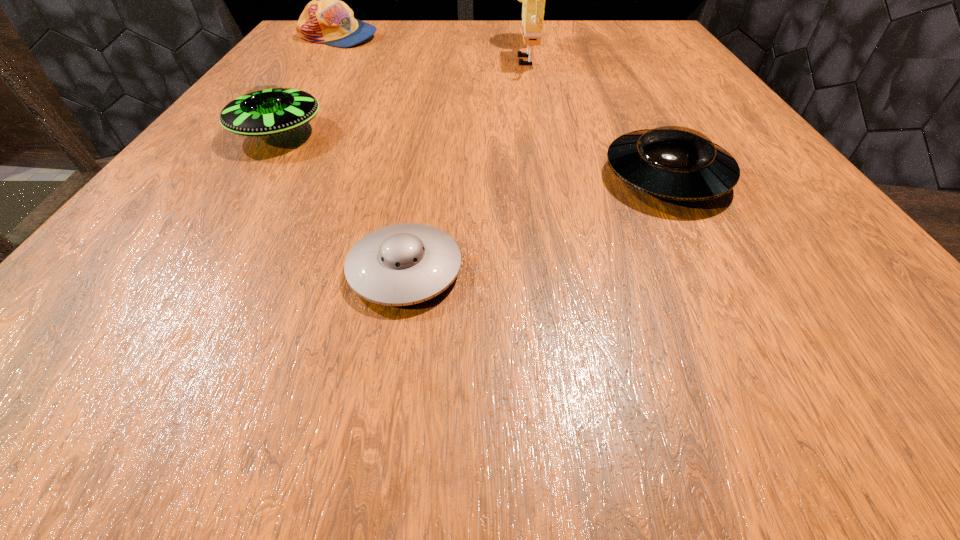
You are a GUI agent. You are given a task and a screenshot of the screen. Output one action in this format:
    pyautogui.click(x=<x>, y=<y>)
    Task: Click on the free space located on the front-facing side of the fourth object from left to right
    
    Given the screenshot: What is the action you would take?
    tap(332, 54)

The height and width of the screenshot is (540, 960). What are the coordinates of `free space located on the bill of the cap` in the screenshot? It's located at (440, 37).

You are a GUI agent. You are given a task and a screenshot of the screen. Output one action in this format:
    pyautogui.click(x=<x>, y=<y>)
    Task: Click on the vacant space situated on the front of the leftmost saucer
    Image resolution: width=960 pixels, height=540 pixels.
    Given the screenshot: What is the action you would take?
    pyautogui.click(x=185, y=276)

The image size is (960, 540). Find the location of `vacant space located 0.360m on the left of the rightmost object`. vacant space located 0.360m on the left of the rightmost object is located at coordinates (341, 177).

Find the location of `vacant area located 0.130m on the left of the nearest saucer`. vacant area located 0.130m on the left of the nearest saucer is located at coordinates (228, 270).

At what (x,y) coordinates should I click in order to perform the action: click on sponge that is at the far edge. Please return your answer as a coordinate pair (x, y). Looking at the image, I should click on (533, 0).

Locate an element on the screen. cap at the far edge is located at coordinates (326, 19).

Locate an element on the screen. Image resolution: width=960 pixels, height=540 pixels. cap at the left edge is located at coordinates (326, 19).

In order to click on saucer present at the left edge in this screenshot , I will do `click(265, 110)`.

This screenshot has height=540, width=960. What are the coordinates of `object at the right edge` in the screenshot? It's located at (673, 162).